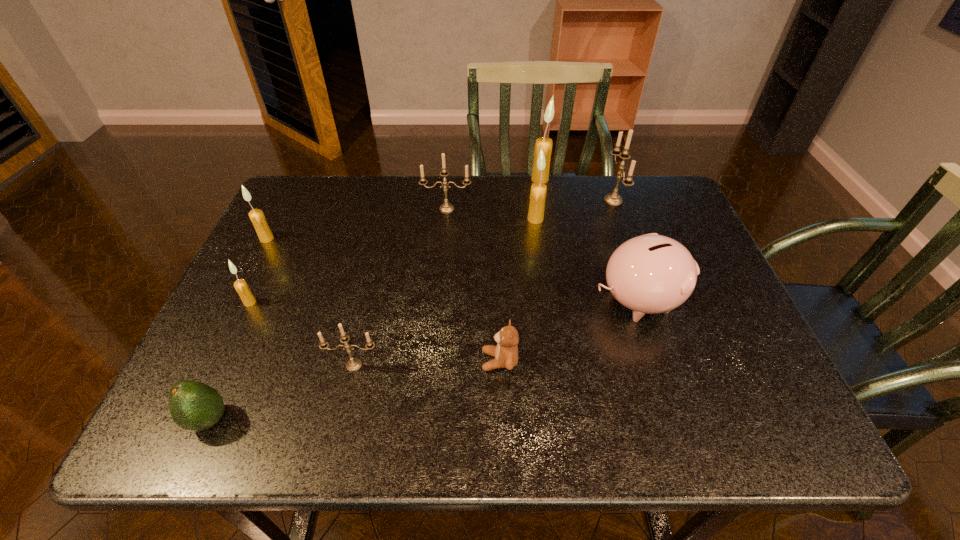
Select which object is the seventh closest to the fifth object from right to left. Please provide its 2D coordinates. Your answer should be formatted as a tuple, i.e. [(x, y)], where the tuple contains the x and y coordinates of a point satisfying the conditions above.

[(240, 285)]

Where is `candle that stands as the fifth closest to the teddy bear`? The image size is (960, 540). candle that stands as the fifth closest to the teddy bear is located at coordinates (240, 285).

The height and width of the screenshot is (540, 960). I want to click on candle that stands as the sixth closest to the rightmost candle, so click(240, 285).

At what (x,y) coordinates should I click in order to perform the action: click on cream candle that can be found as the closest to the tallest candle. Please return your answer as a coordinate pair (x, y). Looking at the image, I should click on (538, 190).

This screenshot has height=540, width=960. I want to click on cream candle object that ranks as the third closest to the biggest cream candle, so click(240, 285).

Identify which metallic candle is the third closest to the pink piggy bank. Please provide its 2D coordinates. Your answer should be formatted as a tuple, i.e. [(x, y)], where the tuple contains the x and y coordinates of a point satisfying the conditions above.

[(353, 364)]

Find the location of a particular element. Image resolution: width=960 pixels, height=540 pixels. metallic candle identified as the third closest to the third cream candle from right to left is located at coordinates (614, 198).

The image size is (960, 540). Find the location of `vacant space that satisfies the following two spatial constraints: 1. on the back side of the fifth candle from right to left; 2. on the right side of the third smallest cream candle`. vacant space that satisfies the following two spatial constraints: 1. on the back side of the fifth candle from right to left; 2. on the right side of the third smallest cream candle is located at coordinates (388, 219).